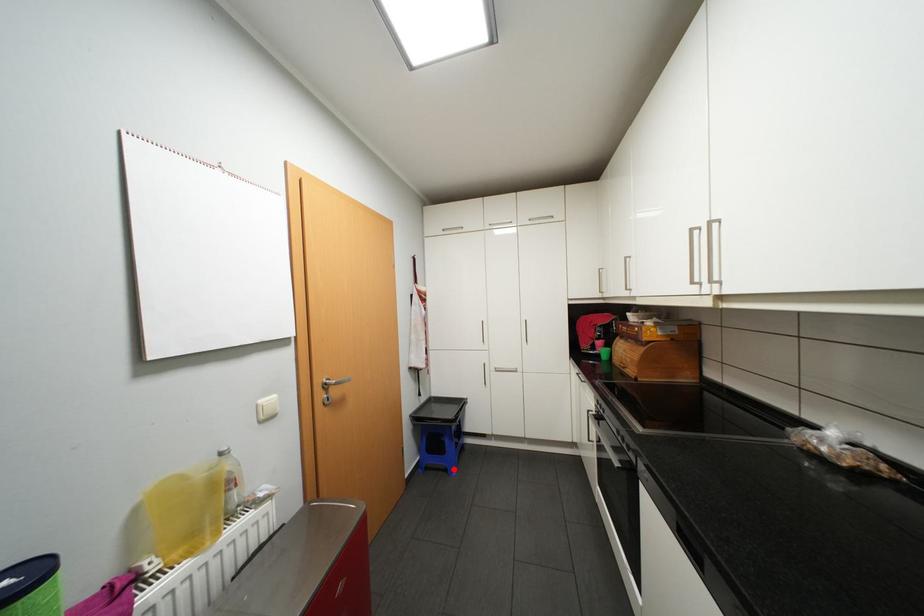
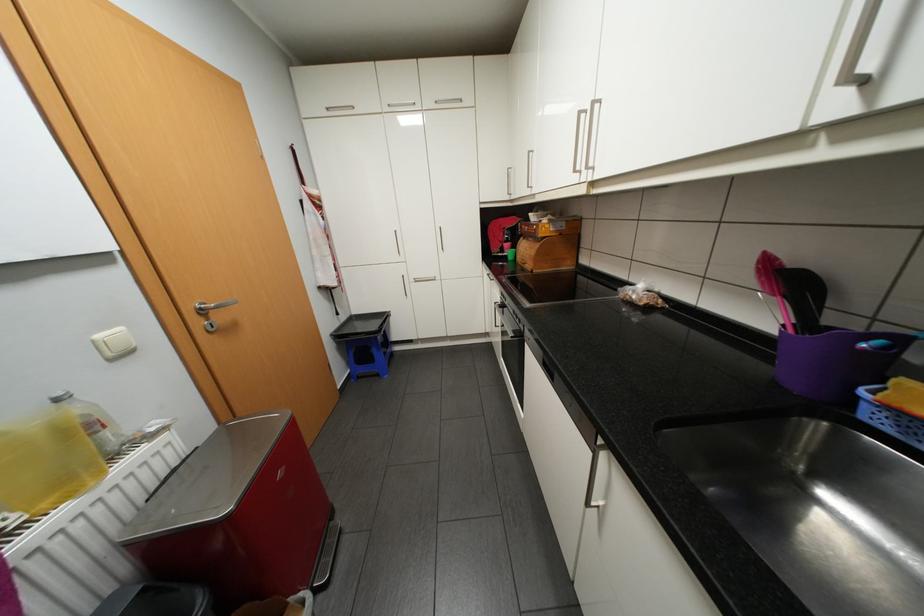
Where in the second image is the point corresponding to the highlighted location from the first image?

(385, 374)